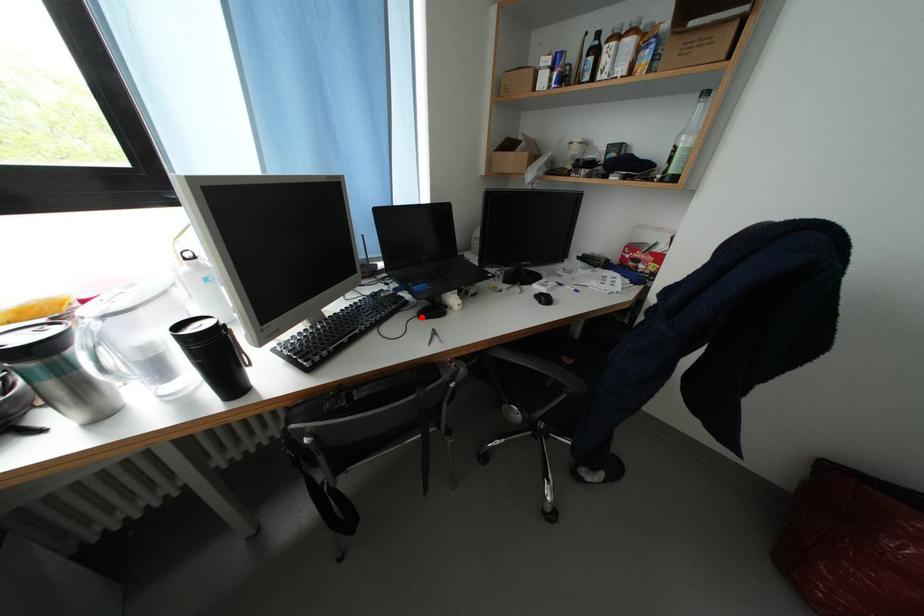
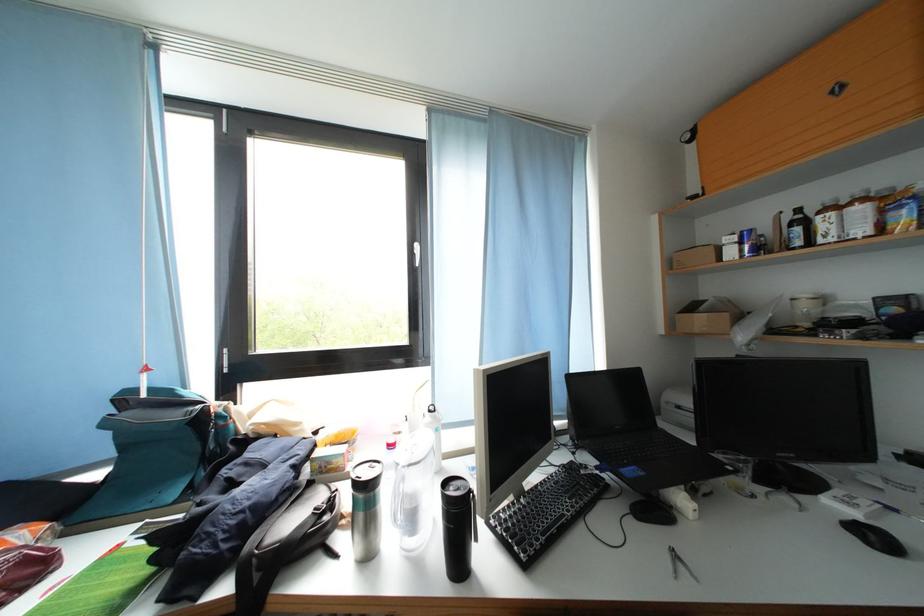
The point at the highlighted location is marked in the first image. Where is the corresponding point in the second image?

(630, 511)